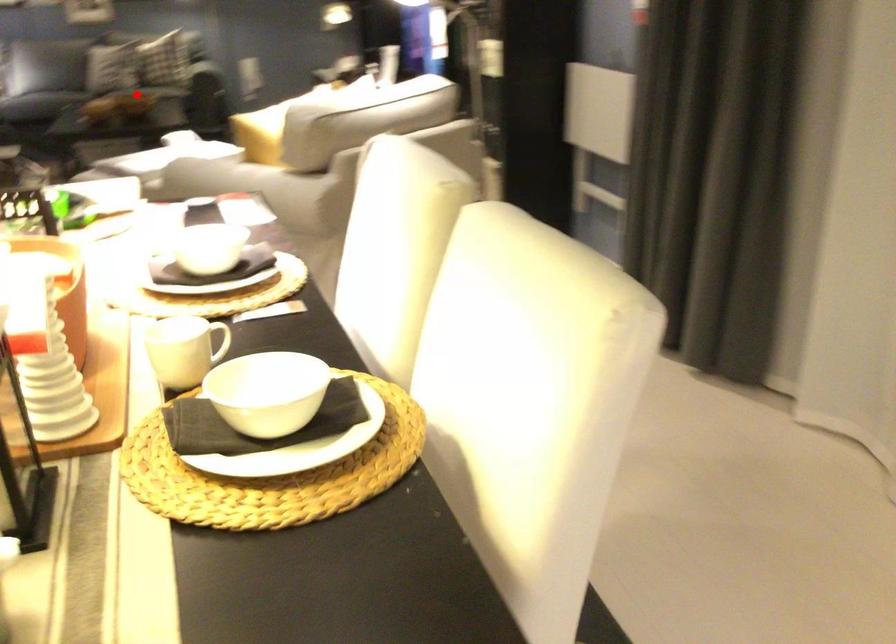
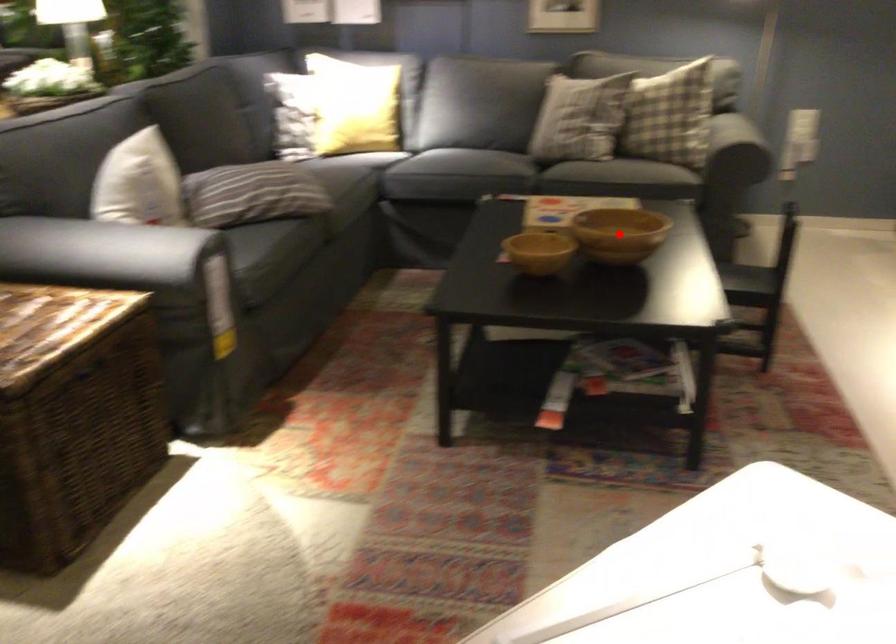
I am providing you with two images of the same scene from different viewpoints. A red point is marked on the first image and another point is marked on the second image. Are the points marked in image1 and image2 representing the same 3D position?

Yes